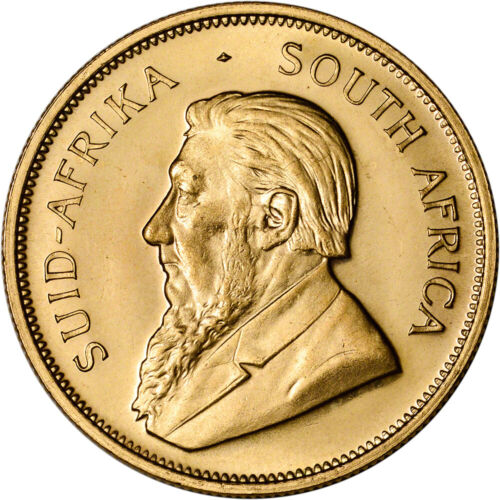
The height and width of the screenshot is (500, 500). Identify the location of coat. (313, 358).